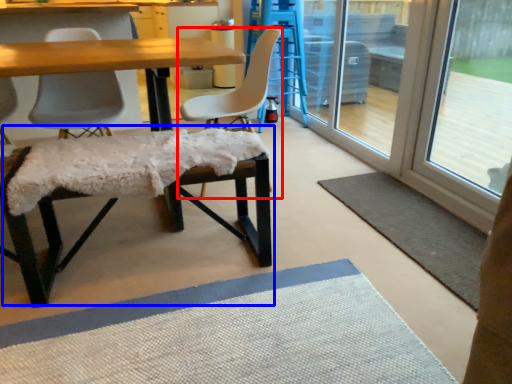
Question: Among these objects, which one is farthest to the camera, chair (highlighted by a red box) or bar stool (highlighted by a blue box)?

Choices:
 (A) chair
 (B) bar stool

Answer: (A)